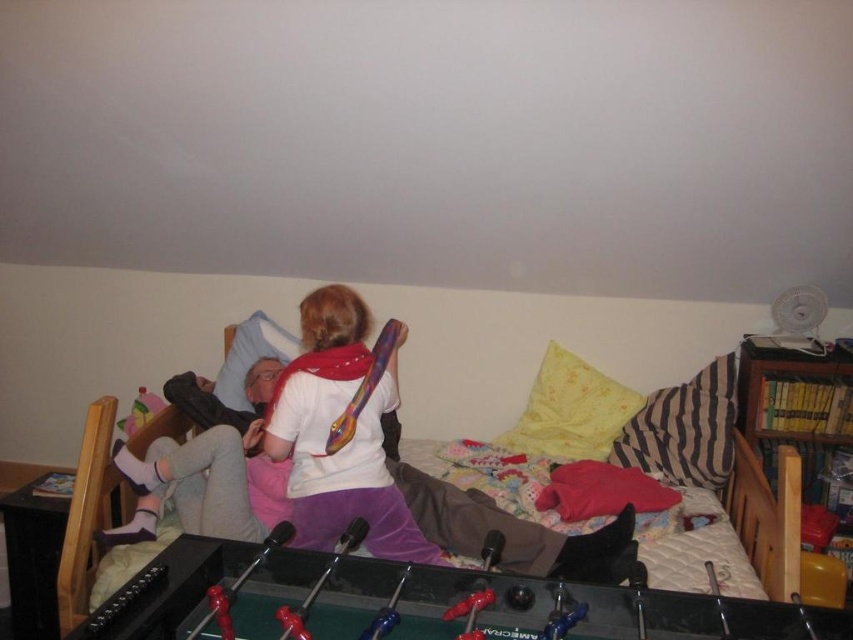
Question: Which object appears farthest from the camera in this image?

Choices:
 (A) white matte t-shirt at upper center
 (B) matte plastic toy at upper left

Answer: (B)

Question: Is black glossy foosball table at lower center positioned at the back of soft cotton bed at center?

Choices:
 (A) no
 (B) yes

Answer: (A)

Question: Is black glossy foosball table at lower center positioned at the back of matte plastic toy at upper left?

Choices:
 (A) no
 (B) yes

Answer: (A)

Question: Does black glossy foosball table at lower center appear over white matte t-shirt at upper center?

Choices:
 (A) no
 (B) yes

Answer: (A)

Question: Which of the following is the closest to the observer?

Choices:
 (A) matte plastic toy at upper left
 (B) black glossy foosball table at lower center

Answer: (B)

Question: Which of these objects is positioned farthest from the black glossy foosball table at lower center?

Choices:
 (A) white matte t-shirt at upper center
 (B) soft cotton bed at center

Answer: (B)